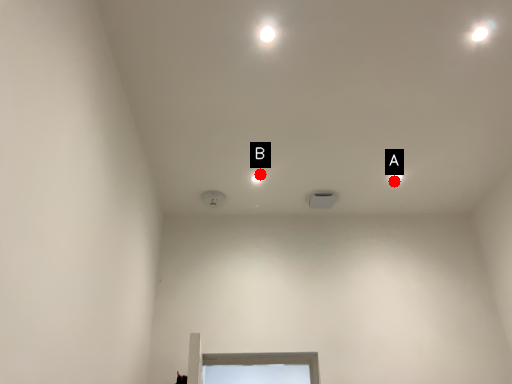
Question: Two points are circled on the image, labeled by A and B beside each circle. Among these points, which one is farthest from the camera?

Choices:
 (A) A is further
 (B) B is further

Answer: (A)